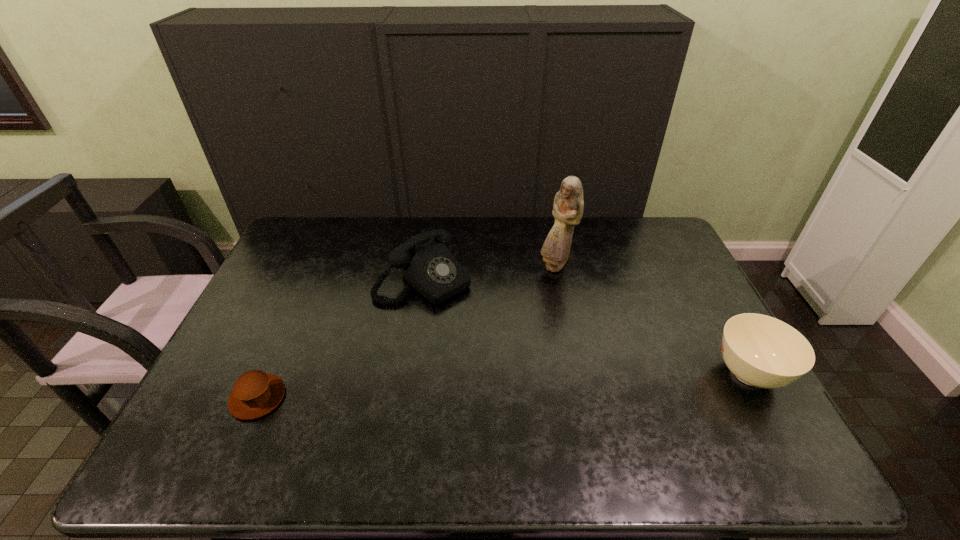
Where is `vacant region located on the front-facing side of the tallest object`? The image size is (960, 540). vacant region located on the front-facing side of the tallest object is located at coordinates (555, 343).

The image size is (960, 540). Identify the location of vacant space situated on the dial of the second object from left to right. (510, 352).

Locate an element on the screen. vacant space located on the dial of the second object from left to right is located at coordinates (492, 337).

Where is `vacant region located 0.280m on the dial of the second object from left to right`? vacant region located 0.280m on the dial of the second object from left to right is located at coordinates (515, 356).

The width and height of the screenshot is (960, 540). In order to click on figurine that is at the far edge in this screenshot , I will do `click(568, 206)`.

Identify the location of telephone present at the far edge. The image size is (960, 540). (426, 263).

Where is `muffin at the near edge`? muffin at the near edge is located at coordinates (255, 393).

This screenshot has width=960, height=540. What are the coordinates of `sugar bowl that is at the near edge` in the screenshot? It's located at (762, 351).

In order to click on object that is at the left edge in this screenshot , I will do `click(255, 393)`.

The height and width of the screenshot is (540, 960). I want to click on object located at the right edge, so click(762, 351).